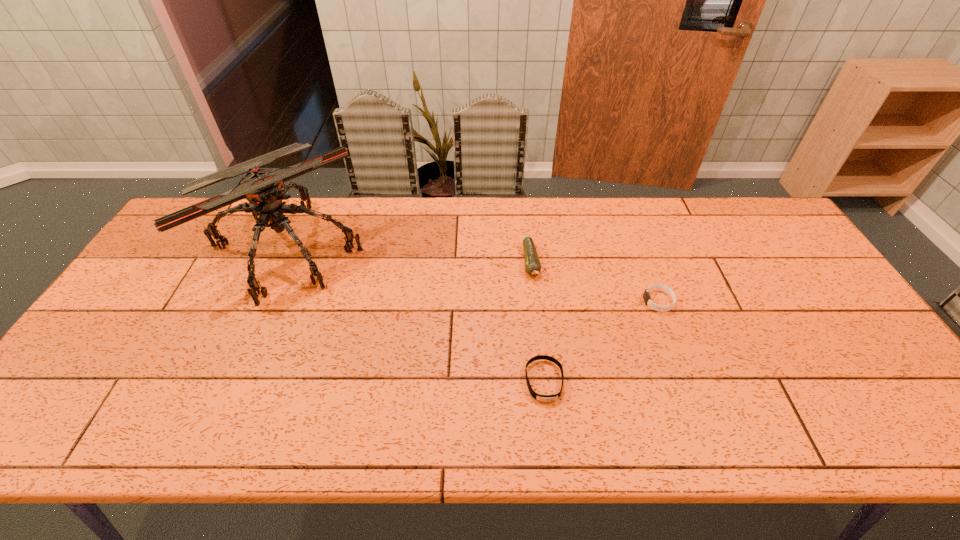
I want to click on drone, so click(x=264, y=189).

Identify the location of the tallest object. The width and height of the screenshot is (960, 540). (264, 189).

Image resolution: width=960 pixels, height=540 pixels. Find the location of `the second tallest object`. the second tallest object is located at coordinates (532, 263).

Find the location of a particular element. This screenshot has width=960, height=540. the farther wristband is located at coordinates (646, 296).

Find the location of a particular element. This screenshot has height=540, width=960. the third tallest object is located at coordinates (646, 296).

The width and height of the screenshot is (960, 540). In order to click on the shorter wristband in this screenshot , I will do `click(543, 398)`.

Where is `the nearest object`? The width and height of the screenshot is (960, 540). the nearest object is located at coordinates (543, 398).

I want to click on free space located on the right of the tallest object, so click(479, 248).

What are the coordinates of `vacant space located 0.100m at the blossom end of the zucchini` in the screenshot? It's located at (537, 310).

At what (x,y) coordinates should I click in order to perform the action: click on vacant space positioned on the outer surface of the third tallest object. Please return your answer as a coordinate pair (x, y). The image size is (960, 540). Looking at the image, I should click on (572, 301).